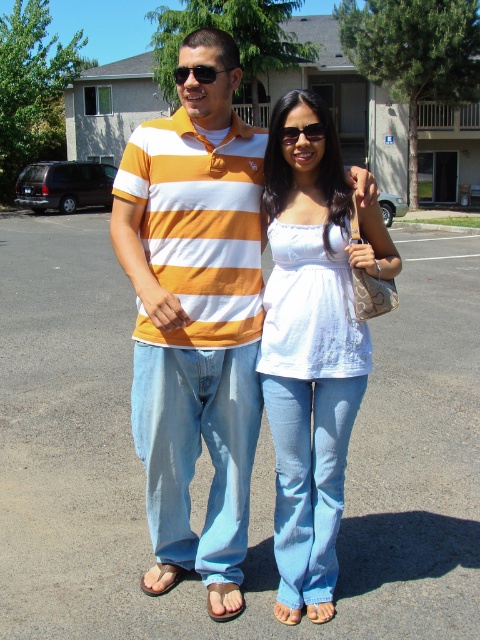
Who is lower down, brown suede sandal at lower center or brown leather sandal at lower center?

brown suede sandal at lower center is below.

Does brown suede sandal at lower center appear under brown leather sandal at lower center?

Indeed, brown suede sandal at lower center is positioned under brown leather sandal at lower center.

Where is `brown suede sandal at lower center`? This screenshot has height=640, width=480. brown suede sandal at lower center is located at coordinates (222, 602).

Where is `brown suede sandal at lower center`? The height and width of the screenshot is (640, 480). brown suede sandal at lower center is located at coordinates (222, 602).

How far apart are orange striped polo shirt at center and black plastic sunglasses at center?

They are 10.47 inches apart.

Which of these two, orange striped polo shirt at center or black plastic sunglasses at center, stands taller?

Standing taller between the two is orange striped polo shirt at center.

Is point (188, 124) behind point (296, 128)?

That is True.

The width and height of the screenshot is (480, 640). I want to click on orange striped polo shirt at center, so click(199, 227).

Is point (201, 86) farther from viewer compared to point (316, 138)?

No, it is in front of (316, 138).

Is matte striped polo shirt at center above black plastic sunglasses at center?

Incorrect, matte striped polo shirt at center is not positioned above black plastic sunglasses at center.

At what (x,y) coordinates should I click in order to perform the action: click on matte striped polo shirt at center. Please return your answer as a coordinate pair (x, y). This screenshot has width=480, height=640. Looking at the image, I should click on (194, 307).

Where is `matte striped polo shirt at center`? The image size is (480, 640). matte striped polo shirt at center is located at coordinates (194, 307).